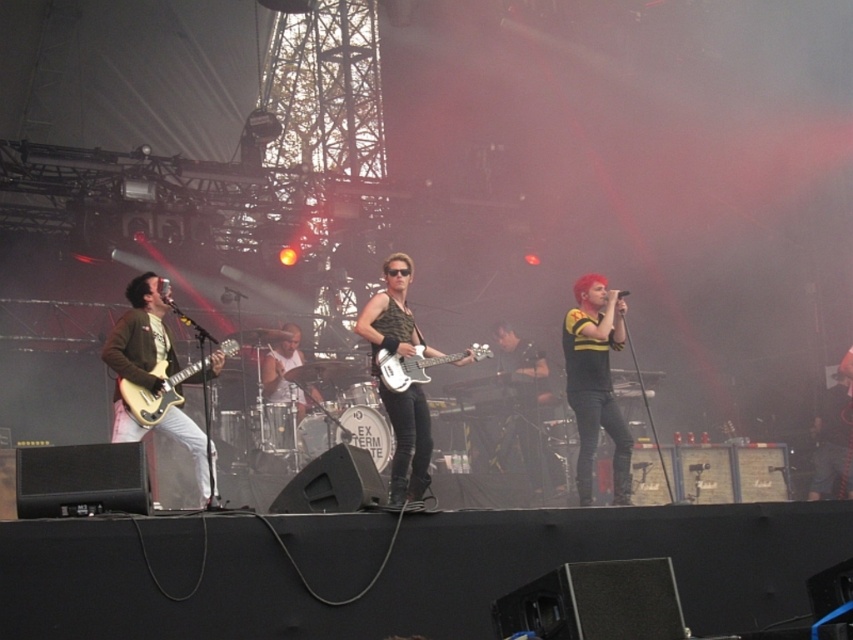
Between point (207, 365) and point (444, 362), which one is positioned behind?

The point (444, 362) is behind.

Can you confirm if matte brown electric guitar at left is positioned to the left of white glossy bass guitar at center?

Yes, matte brown electric guitar at left is to the left of white glossy bass guitar at center.

Find the location of a particular element. This screenshot has height=640, width=853. matte brown electric guitar at left is located at coordinates (165, 387).

This screenshot has width=853, height=640. Identify the location of shiny black microphone at center. (595, 381).

Between point (607, 323) and point (402, 380), which one is positioned in front?

Point (402, 380)

At what (x,y) coordinates should I click in order to perform the action: click on shiny black microphone at center. Please return your answer as a coordinate pair (x, y). The width and height of the screenshot is (853, 640). Looking at the image, I should click on (595, 381).

Is camouflage fabric tank top at center wider than matte brown electric guitar at left?

No.

Which is behind, point (361, 320) or point (224, 356)?

The point (361, 320) is more distant.

Locate an element on the screen. Image resolution: width=853 pixels, height=640 pixels. camouflage fabric tank top at center is located at coordinates (405, 388).